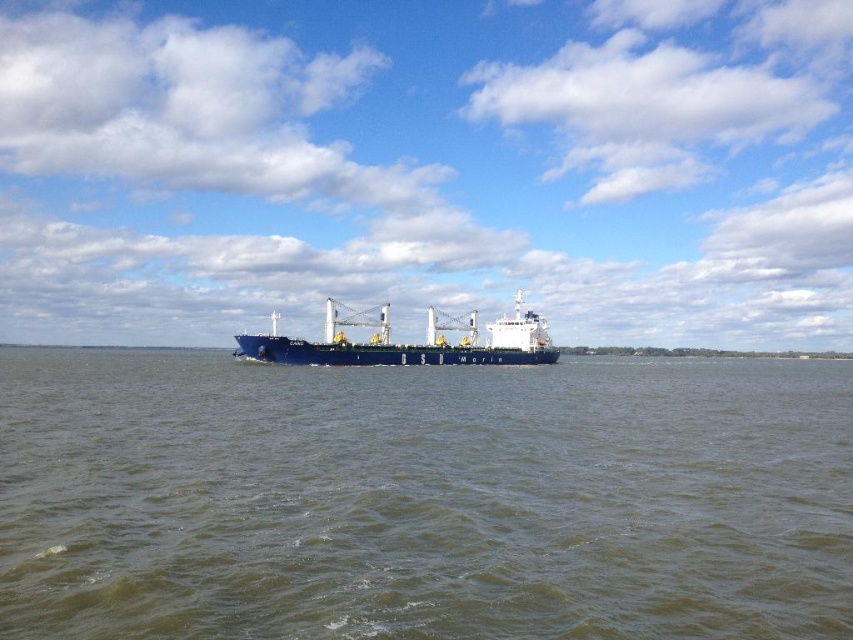
You are a photographer trying to capture the blue matte cargo ship at center from the shore. Since the brown water at center is wider than the ship, will the ship appear smaller in the photo compared to the water?

The brown water at center is wider than the blue matte cargo ship at center, so the ship will appear smaller in the photo compared to the water.